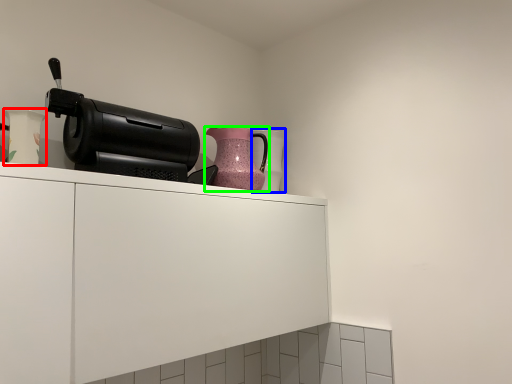
Question: Estimate the real-world distances between objects in this image. Which object is closer to vase (highlighted by a red box), vase (highlighted by a blue box) or jug (highlighted by a green box)?

Choices:
 (A) vase
 (B) jug

Answer: (B)